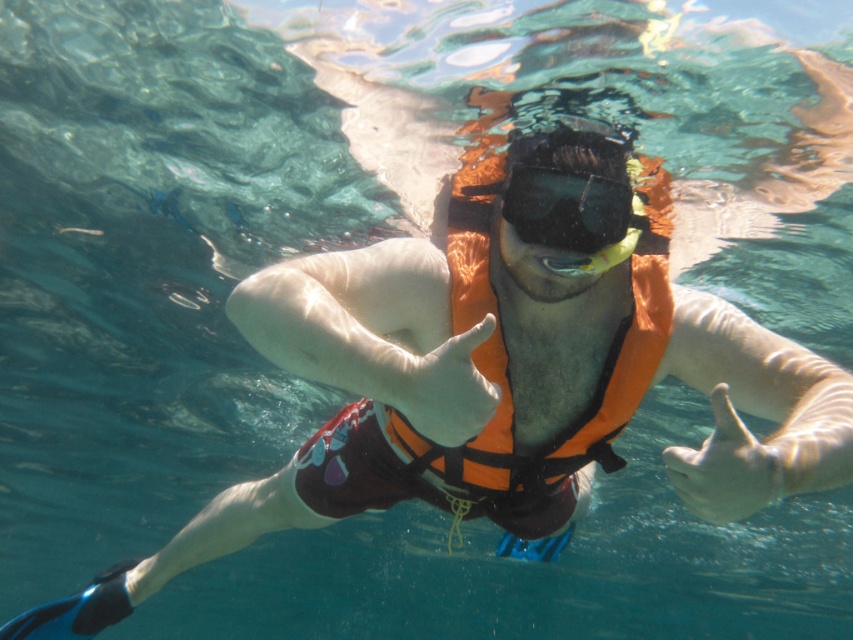
You are a lifeguard standing on the beach and see a point in the water at coordinates (589, 150). If you want to throw a rescue buoy to that point, and the buoy can travel 2 meters, will it reach the point?

The point at (589, 150) is 2.03 meters away from the viewer. Since the rescue buoy can travel 2 meters, it will not quite reach the point as it is 0.03 meters too far.

You are a scuba diver planning to place a marker between the two points, point (512, 204) and point (593, 218). Which point is closer to you so you can attach the marker first?

Point (512, 204) is closer to you, so you should attach the marker there first.

You are a marine biologist observing an underwater scene. You notice the orange fabric life jacket at center and the black matte snorkel mask at center. Which object is closer to you from your observation point?

The orange fabric life jacket at center is closer to you because it is in front of the black matte snorkel mask at center.